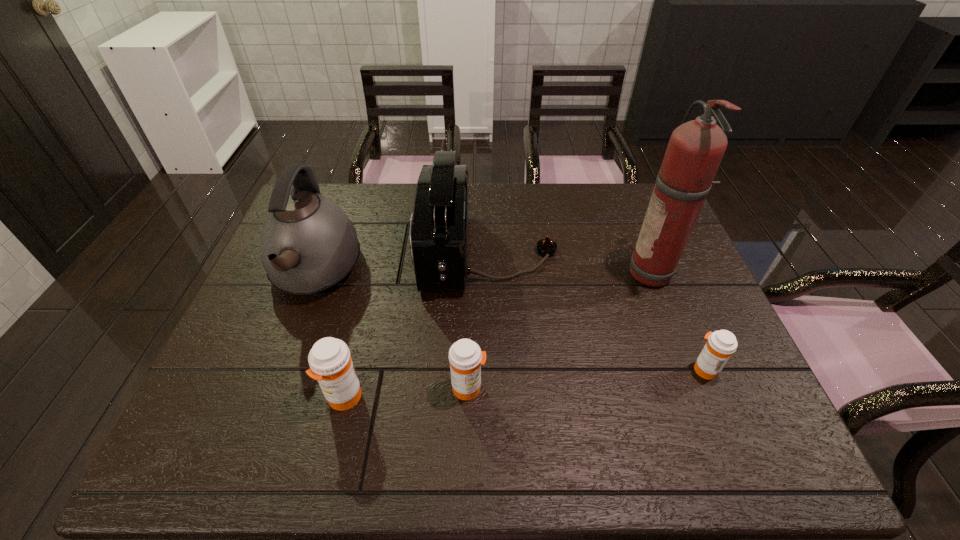
Image resolution: width=960 pixels, height=540 pixels. What are the coordinates of `free space that satisfies the following two spatial constraints: 1. on the side of the tallest object with the label and nozzle; 2. on the front side of the leftmost medicine` in the screenshot? It's located at (703, 397).

The image size is (960, 540). Find the location of `free location that satisfies the following two spatial constraints: 1. at the spout of the kettle; 2. on the left side of the rightmost medicine`. free location that satisfies the following two spatial constraints: 1. at the spout of the kettle; 2. on the left side of the rightmost medicine is located at coordinates (279, 369).

In order to click on free spot that satisfies the following two spatial constraints: 1. on the front-facing side of the radio receiver; 2. on the front side of the second tallest medicine in this screenshot , I will do `click(491, 388)`.

This screenshot has width=960, height=540. In order to click on vacant space that satisfies the following two spatial constraints: 1. at the spout of the second tallest medicine; 2. on the left side of the kettle in this screenshot , I will do `click(273, 388)`.